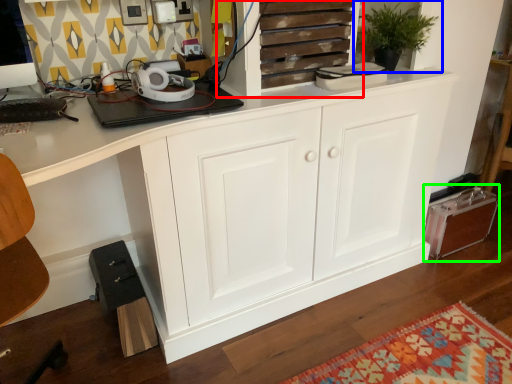
Question: Estimate the real-world distances between objects in this image. Which object is closer to cupboard (highlighted by a red box), houseplant (highlighted by a blue box) or cabinetry (highlighted by a green box)?

Choices:
 (A) houseplant
 (B) cabinetry

Answer: (A)